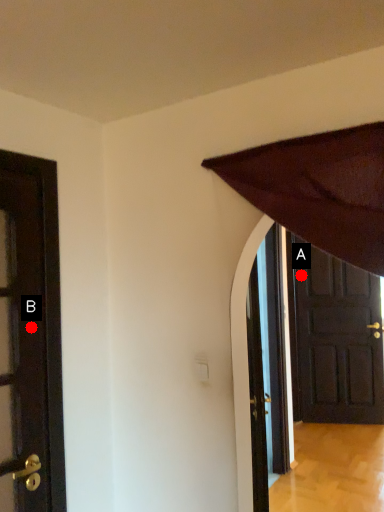
Question: Two points are circled on the image, labeled by A and B beside each circle. Which point appears farthest from the camera in this image?

Choices:
 (A) A is further
 (B) B is further

Answer: (A)